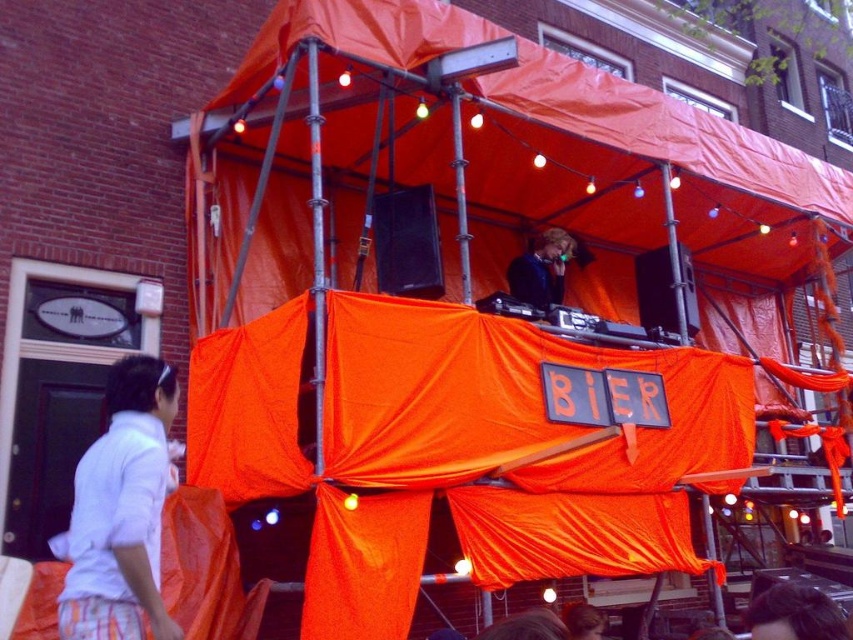
Based on the photo, between blonde hair at upper center and blonde hair dj at center, which one appears on the right side from the viewer's perspective?

blonde hair at upper center is more to the right.

Describe the element at coordinates (793, 614) in the screenshot. Image resolution: width=853 pixels, height=640 pixels. I see `blonde hair at upper center` at that location.

What are the coordinates of `blonde hair at upper center` in the screenshot? It's located at (793, 614).

Is blonde hair at upper center to the left of blonde hair at lower center from the viewer's perspective?

In fact, blonde hair at upper center is to the right of blonde hair at lower center.

Between blonde hair at upper center and blonde hair at lower center, which one has less height?

With less height is blonde hair at upper center.

Measure the distance between blonde hair at upper center and camera.

They are 2.54 meters apart.

The width and height of the screenshot is (853, 640). What are the coordinates of `blonde hair at upper center` in the screenshot? It's located at (793, 614).

Which is in front, point (178, 632) or point (590, 614)?

Point (178, 632) is in front.

What do you see at coordinates (120, 509) in the screenshot? The height and width of the screenshot is (640, 853). I see `white cotton shirt at lower left` at bounding box center [120, 509].

The width and height of the screenshot is (853, 640). Describe the element at coordinates (120, 509) in the screenshot. I see `white cotton shirt at lower left` at that location.

Locate an element on the screen. The height and width of the screenshot is (640, 853). white cotton shirt at lower left is located at coordinates (120, 509).